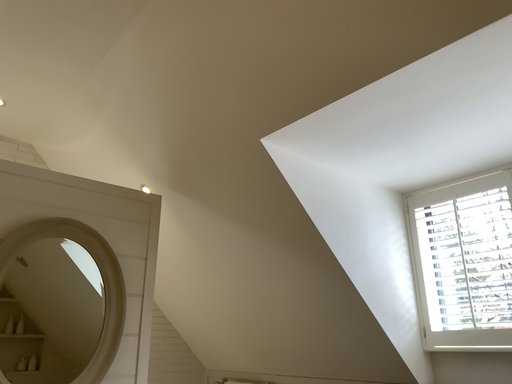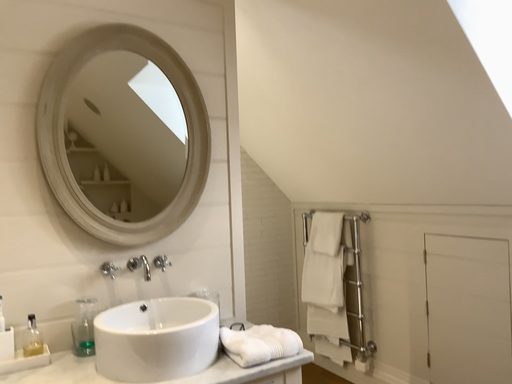
Question: Which way did the camera rotate in the video?

Choices:
 (A) rotated upward
 (B) rotated downward

Answer: (B)